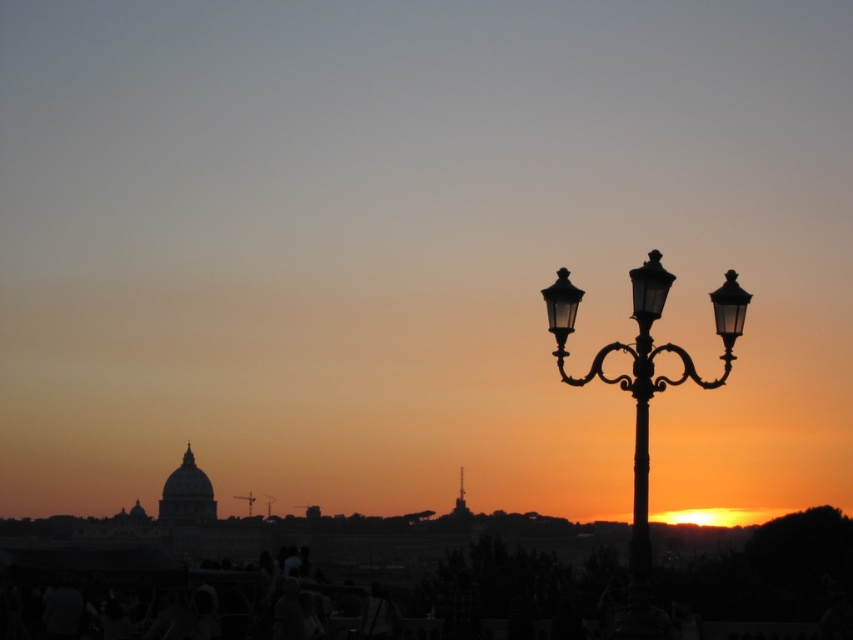
You are standing in the city park and see the black metal lamp post at right and the black metal pole at right. Which one is closer to the center of the park?

The black metal lamp post at right is closer to the center of the park because it is positioned to the left of the black metal pole at right, meaning it is nearer to the middle area.

Looking at this image, you are an urban planner evaluating the placement of street fixtures in a city park. You notice two black metal structures on the right side of the scene. Which one is bigger between the black metal lamp post at right and the black metal pole at right?

The black metal lamp post at right is larger in size compared to the black metal pole at right.